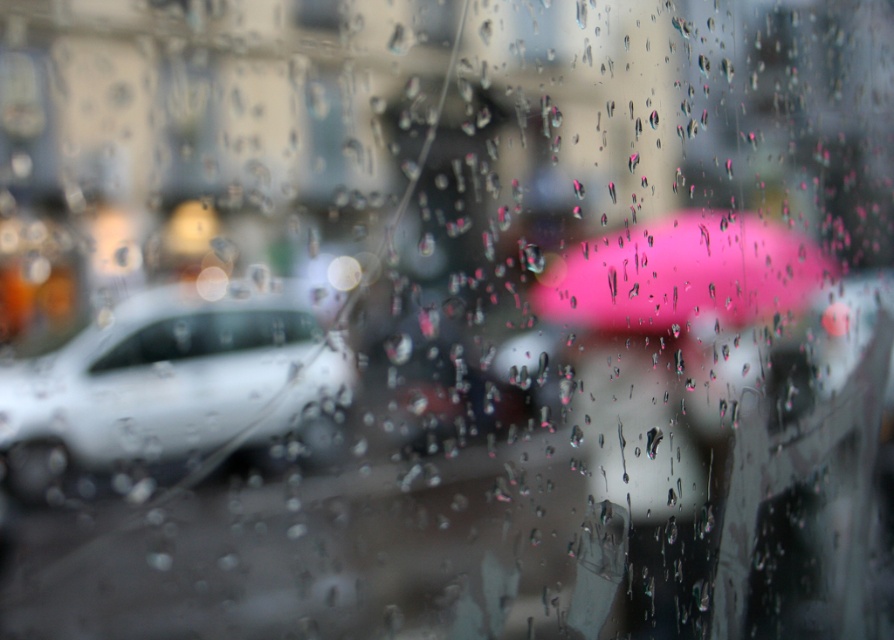
Question: Is white matte car at left positioned at the back of clear glass car at left?

Choices:
 (A) no
 (B) yes

Answer: (A)

Question: Does white matte car at left appear over clear glass car at left?

Choices:
 (A) yes
 (B) no

Answer: (B)

Question: Which point is closer to the camera?

Choices:
 (A) white matte car at left
 (B) clear glass car at left
 (C) pink matte umbrella at center

Answer: (A)

Question: Can you confirm if white matte car at left is positioned to the left of pink matte umbrella at center?

Choices:
 (A) yes
 (B) no

Answer: (A)

Question: Which of the following is the closest to the observer?

Choices:
 (A) (209, 362)
 (B) (176, 355)

Answer: (B)

Question: Which point is farther to the camera?

Choices:
 (A) pink matte umbrella at center
 (B) white matte car at left

Answer: (A)